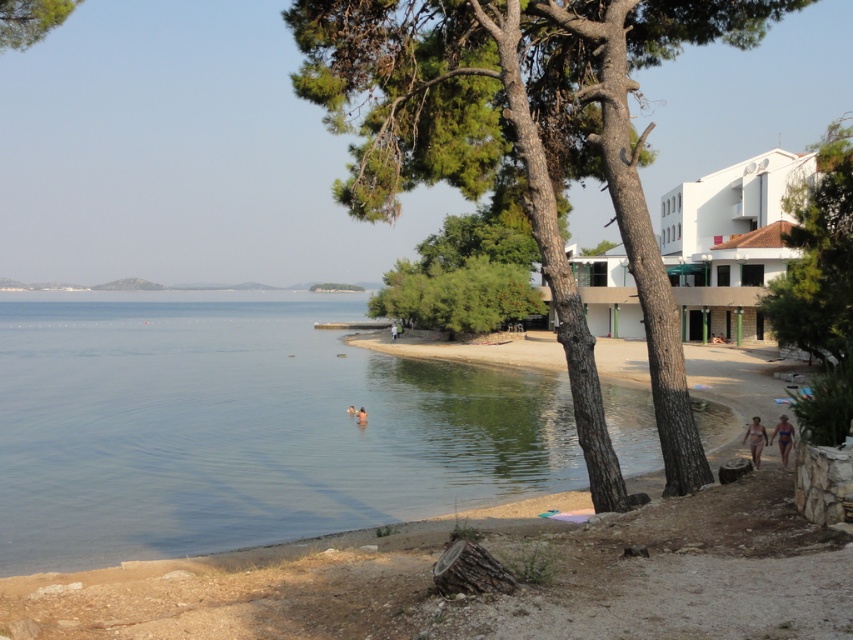
Question: Which of these objects is positioned closest to the blue fabric bikini at lower right?

Choices:
 (A) smooth skin person at center
 (B) clear water at beach left
 (C) matte pink bikini at lower right
 (D) green leafy tree at center

Answer: (C)

Question: Which point appears farthest from the camera in this image?

Choices:
 (A) (758, 436)
 (B) (1, 0)
 (C) (782, 428)
 (D) (822, 218)

Answer: (D)

Question: Is clear water at beach left thinner than matte pink bikini at lower right?

Choices:
 (A) yes
 (B) no

Answer: (B)

Question: Can you confirm if clear water at beach left is bigger than green leafy tree at upper left?

Choices:
 (A) no
 (B) yes

Answer: (B)

Question: Can you confirm if green textured tree at center is thinner than smooth skin person at center?

Choices:
 (A) no
 (B) yes

Answer: (A)

Question: Which point is farther from the camera taking this photo?

Choices:
 (A) (351, 412)
 (B) (747, 426)

Answer: (A)